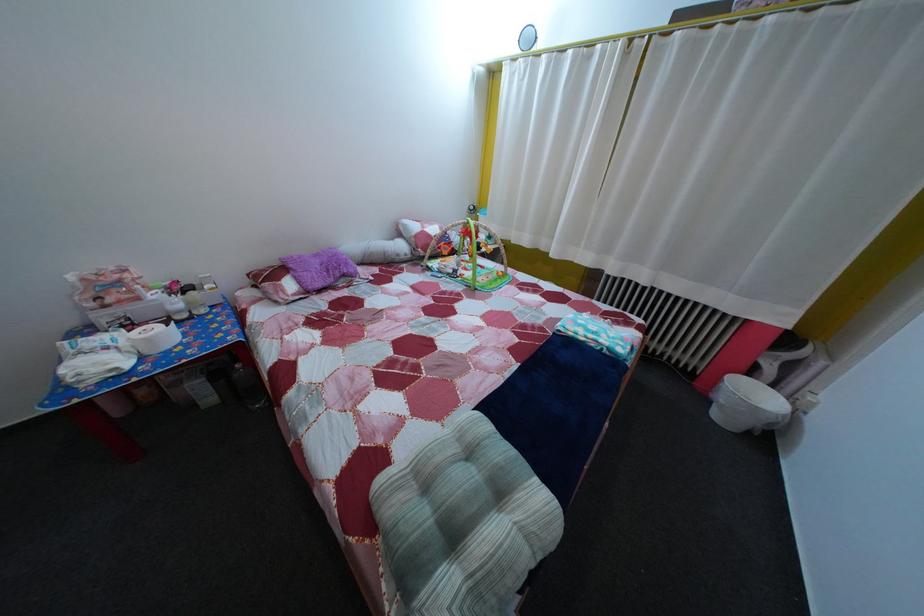
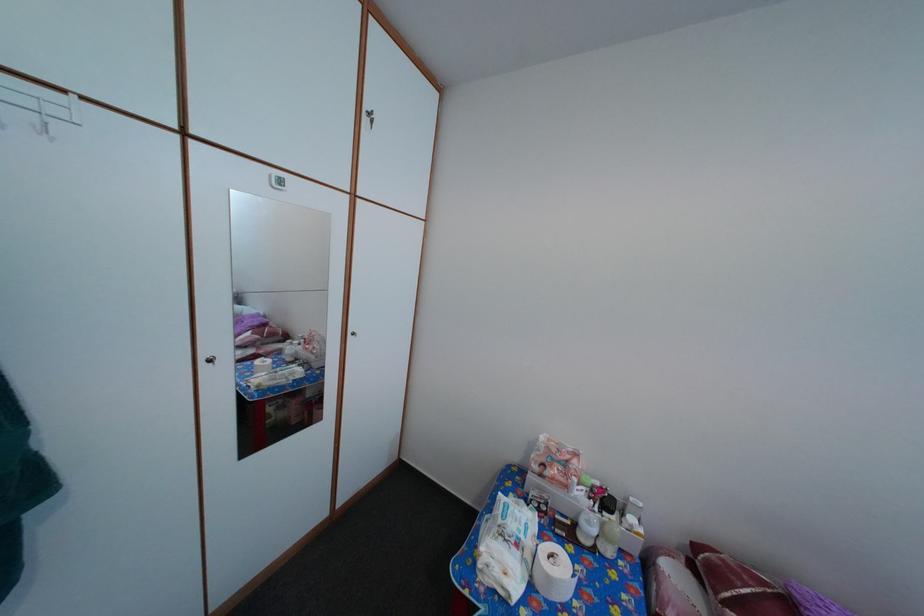
Where in the second image is the point corresponding to pixel 129 289 from the first image?

(576, 469)